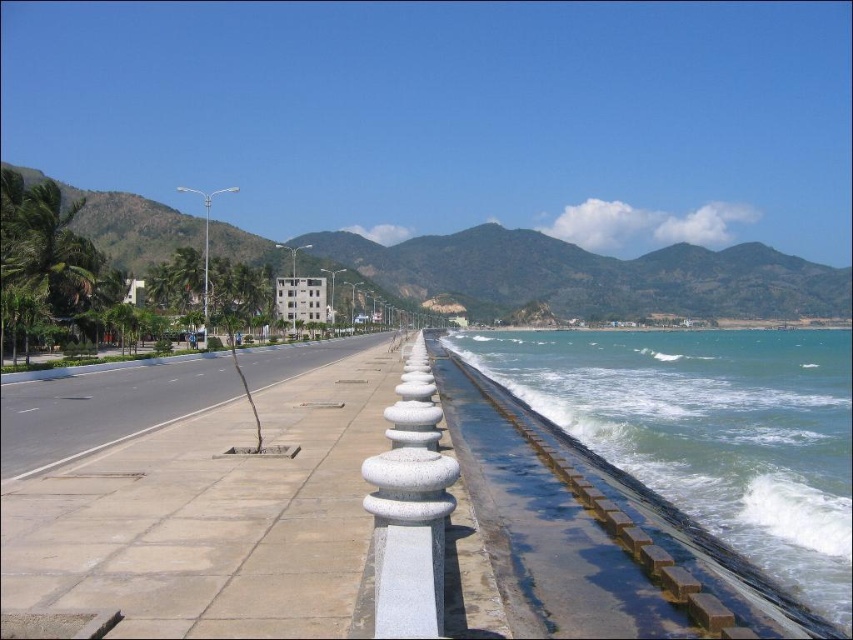
You are a delivery person with a cart that is 1.2 meters wide. You need to navigate through the area between the light gray concrete sidewalk at center and the white stone pillar at center. Can your cart fit through this space?

The light gray concrete sidewalk at center is wider than the white stone pillar at center, but the exact width difference isn not specified. Without knowing the exact widths, it is impossible to determine if the 1.2 meter wide cart can fit through the space between them.